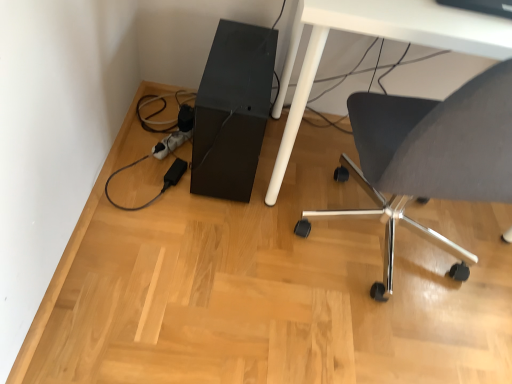
Locate an element on the screen. free spot in front of matte gray chair at lower right is located at coordinates 359,343.